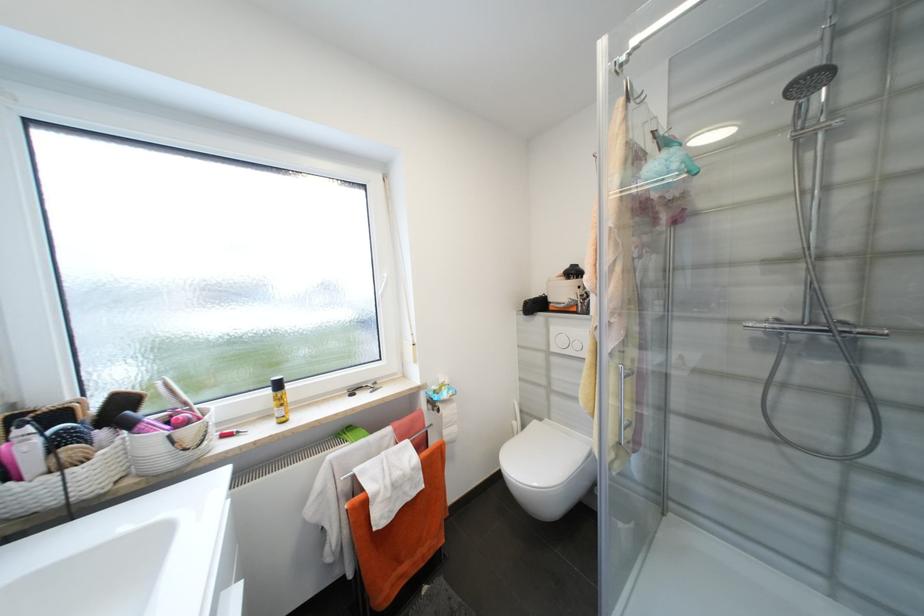
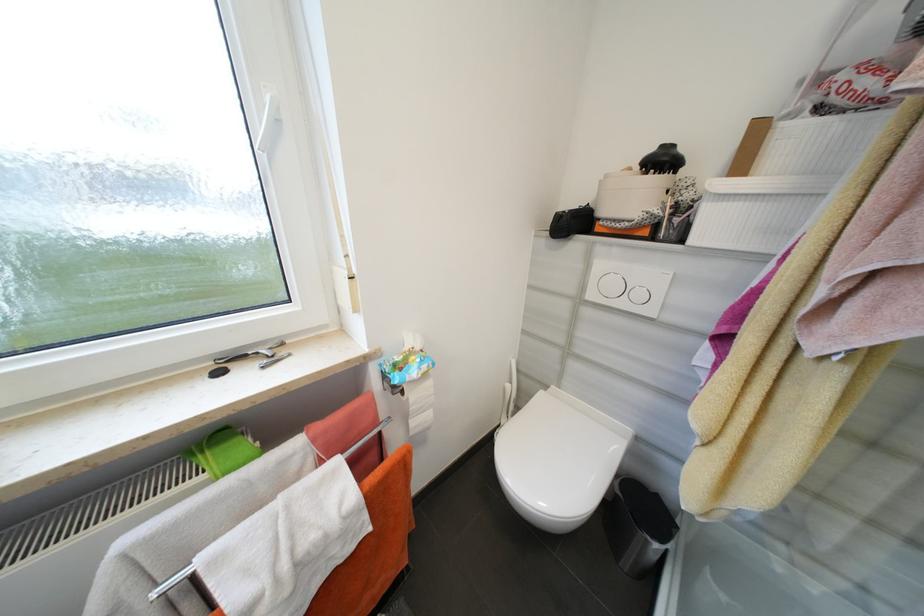
Locate, in the second image, the point that corresponds to (444,411) in the first image.

(407, 392)